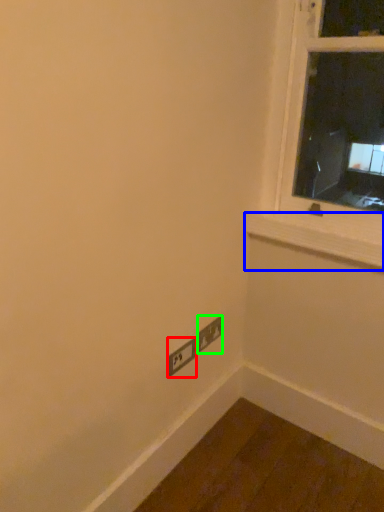
Question: Based on their relative distances, which object is farther from power plugs and sockets (highlighted by a red box)? Choose from window sill (highlighted by a blue box) and power plugs and sockets (highlighted by a green box).

Choices:
 (A) window sill
 (B) power plugs and sockets

Answer: (A)